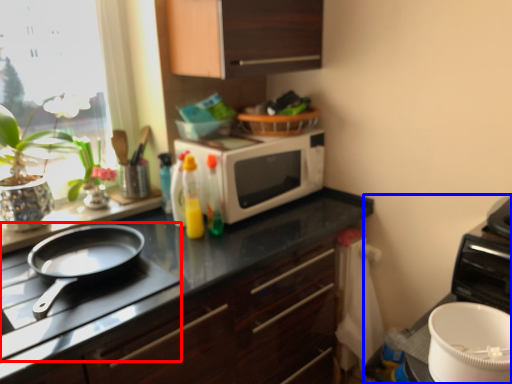
Question: Among these objects, which one is farthest to the camera, gas stove (highlighted by a red box) or appliance (highlighted by a blue box)?

Choices:
 (A) gas stove
 (B) appliance

Answer: (B)